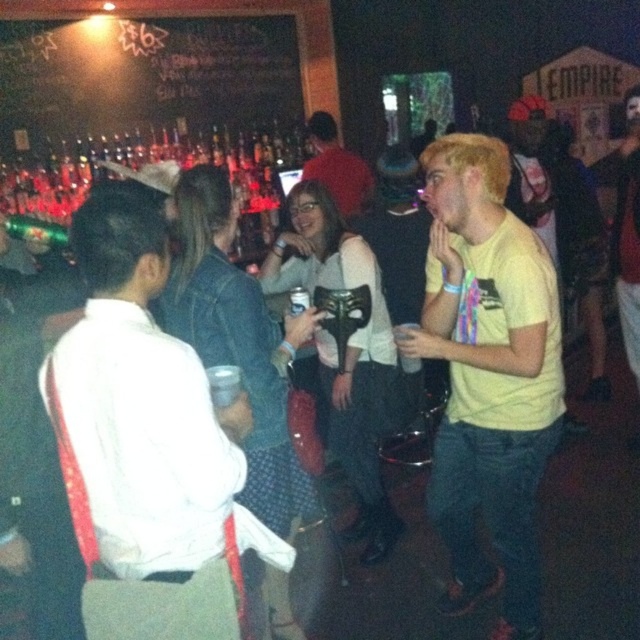
Question: Which point is closer to the camera taking this photo?

Choices:
 (A) (202, 417)
 (B) (362, 198)
 (C) (451, 186)
 (D) (67, 586)

Answer: (A)

Question: Does white matte shirt at left appear on the right side of yellow matte t-shirt at center?

Choices:
 (A) yes
 (B) no

Answer: (B)

Question: Among these points, which one is nearest to the camera?

Choices:
 (A) (502, 362)
 (B) (64, 531)
 (C) (125, 232)
 (D) (317, 124)

Answer: (C)

Question: Estimate the real-world distances between objects in this image. Which object is farther from the white matte shirt at left?

Choices:
 (A) yellow matte t-shirt at center
 (B) white fabric shirt at left
 (C) matte red shirt at center

Answer: (C)

Question: From the image, what is the correct spatial relationship of yellow matte t-shirt at center in relation to matte red shirt at center?

Choices:
 (A) above
 (B) below

Answer: (B)

Question: Can you confirm if white matte shirt at left is smaller than yellow matte t-shirt at center?

Choices:
 (A) yes
 (B) no

Answer: (A)